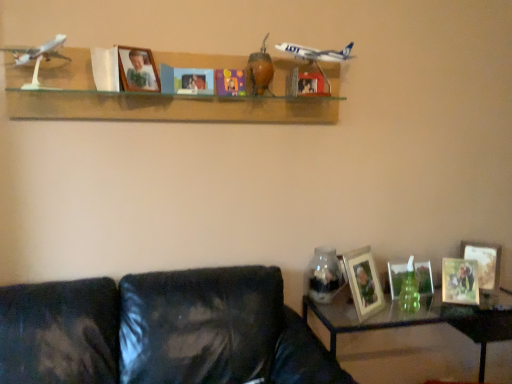
Question: Considering the positions of wooden photo frame at upper center, which is the 7th picture frame in right-to-left order, and wooden photo frame at lower right, placed as the fourth picture frame when sorted from left to right, in the image, is wooden photo frame at upper center, which is the 7th picture frame in right-to-left order, wider or thinner than wooden photo frame at lower right, placed as the fourth picture frame when sorted from left to right,?

Choices:
 (A) thin
 (B) wide

Answer: (A)

Question: From the image's perspective, is wooden photo frame at upper center, the first picture frame from the left, positioned above or below wooden photo frame at lower right, positioned as the 4th picture frame in right-to-left order?

Choices:
 (A) above
 (B) below

Answer: (A)

Question: Estimate the real-world distances between objects in this image. Which object is farther from the matte white picture frame at lower right, the third picture frame when ordered from right to left?

Choices:
 (A) wooden photo frame at lower right, which ranks as the seventh picture frame in left-to-right order
 (B) black leather couch at lower left
 (C) wooden photo frame at upper center, which is the 7th picture frame in right-to-left order
 (D) wooden photo frame at lower right, positioned as the 4th picture frame in right-to-left order
 (E) clear glass table at lower right

Answer: (C)

Question: Considering the real-world distances, which object is farthest from the matte wooden picture frame at center, the 2th picture frame when ordered from left to right?

Choices:
 (A) black leather couch at lower left
 (B) wooden photo frame at lower right, placed as the fourth picture frame when sorted from left to right
 (C) clear glass table at lower right
 (D) brown matte vase at center
 (E) wooden photo frame at lower right, which ranks as the seventh picture frame in left-to-right order

Answer: (E)